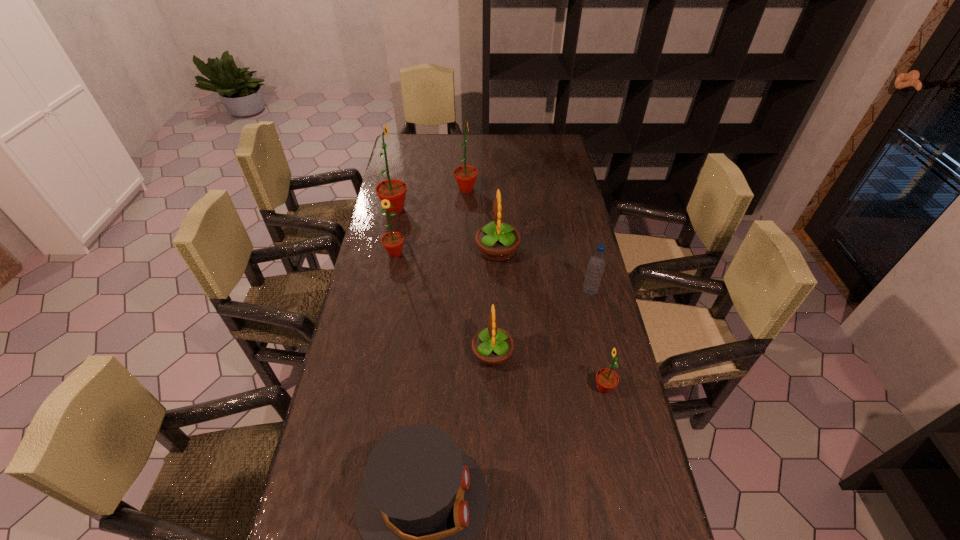
In the image, there is a desktop. Where is `vacant space at the far left corner`? The width and height of the screenshot is (960, 540). vacant space at the far left corner is located at coordinates (422, 148).

Locate an element on the screen. Image resolution: width=960 pixels, height=540 pixels. empty space between the second nearest green sunflower and the seventh nearest object is located at coordinates (395, 231).

This screenshot has width=960, height=540. Find the location of `vacant space in between the tallest sunflower and the third green sunflower from left to right`. vacant space in between the tallest sunflower and the third green sunflower from left to right is located at coordinates (430, 199).

I want to click on vacant region between the second smallest green sunflower and the farthest sunflower, so click(431, 221).

In order to click on empty space that is in between the farthest object and the rightmost green sunflower in this screenshot , I will do `click(535, 289)`.

Identify the location of free space that is in between the rightmost green sunflower and the blue water bottle. (597, 340).

This screenshot has height=540, width=960. In order to click on object that is the seventh nearest to the farthest green sunflower in this screenshot , I will do `click(422, 502)`.

The image size is (960, 540). Identify the location of object that is the fifth closest to the farthest sunflower. (492, 346).

In order to click on the closest sunflower relative to the smaller yellow sunflower in this screenshot , I will do `click(606, 379)`.

The width and height of the screenshot is (960, 540). I want to click on sunflower that can be found as the closest to the smaller yellow sunflower, so click(606, 379).